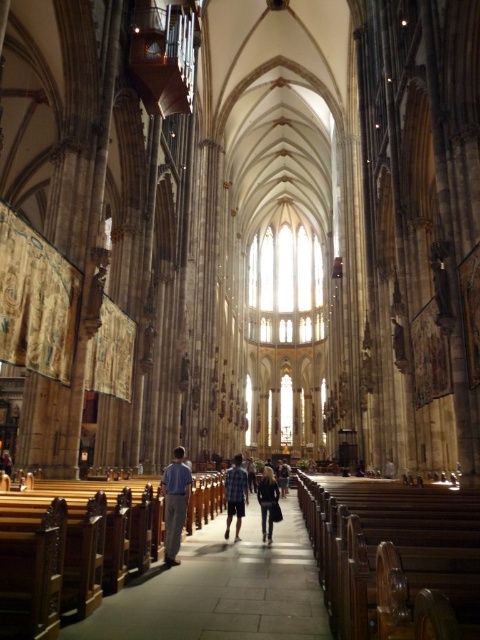
Who is taller, light blue shirt at center or plaid shirt at center?

plaid shirt at center

Between point (191, 476) and point (282, 465), which one is positioned in front?

Positioned in front is point (191, 476).

At what (x,y) coordinates should I click in order to perform the action: click on light blue shirt at center. Please return your answer as a coordinate pair (x, y). Looking at the image, I should click on (175, 502).

This screenshot has width=480, height=640. What do you see at coordinates (175, 502) in the screenshot? I see `light blue shirt at center` at bounding box center [175, 502].

At what (x,y) coordinates should I click in order to perform the action: click on light blue shirt at center. Please return your answer as a coordinate pair (x, y). The image size is (480, 640). Looking at the image, I should click on (175, 502).

Does point (166, 512) come farther from viewer compared to point (237, 536)?

No, it is in front of (237, 536).

You are a GUI agent. You are given a task and a screenshot of the screen. Output one action in this format:
    pyautogui.click(x=<x>, y=<y>)
    Task: Click on the light blue shirt at center
    
    Given the screenshot: What is the action you would take?
    pyautogui.click(x=175, y=502)

Based on the photo, does wooden pews at center have a greater height compared to light blue shirt at center?

Yes.

Does wooden pews at center lie in front of light blue shirt at center?

Yes, it is in front of light blue shirt at center.

Is point (220, 576) farther from viewer compared to point (175, 467)?

No, it is not.

Identify the location of wooden pews at center. The height and width of the screenshot is (640, 480). (222, 589).